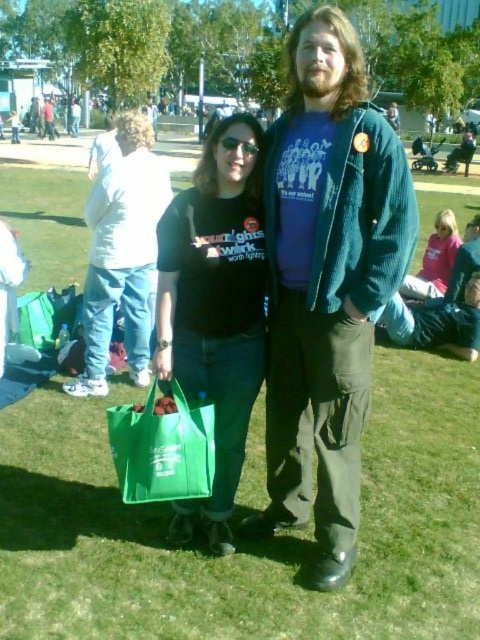
Which of these two, matte black shirt at center or green fabric bag at lower left, stands shorter?

Standing shorter between the two is green fabric bag at lower left.

Can you confirm if matte black shirt at center is bigger than green fabric bag at lower left?

Correct, matte black shirt at center is larger in size than green fabric bag at lower left.

Measure the distance between matte black shirt at center and camera.

matte black shirt at center is 3.74 meters from camera.

I want to click on matte black shirt at center, so click(122, 256).

Can you confirm if matte black shirt at center is shorter than pink fabric shirt at upper right?

No, matte black shirt at center is not shorter than pink fabric shirt at upper right.

What do you see at coordinates (122, 256) in the screenshot? I see `matte black shirt at center` at bounding box center [122, 256].

Is point (166, 205) farther from viewer compared to point (450, 216)?

No, it is not.

Identify the location of matte black shirt at center. The width and height of the screenshot is (480, 640). (122, 256).

Can you confirm if green fabric bag at lower left is wider than matte white shirt at upper left?

Incorrect, green fabric bag at lower left's width does not surpass matte white shirt at upper left's.

Based on the photo, between green fabric bag at lower left and matte white shirt at upper left, which one appears on the right side from the viewer's perspective?

From the viewer's perspective, green fabric bag at lower left appears more on the right side.

What do you see at coordinates (163, 448) in the screenshot? I see `green fabric bag at lower left` at bounding box center [163, 448].

You are a GUI agent. You are given a task and a screenshot of the screen. Output one action in this format:
    pyautogui.click(x=<x>, y=<y>)
    Task: Click on the green fabric bag at lower left
    The image size is (480, 640).
    Given the screenshot: What is the action you would take?
    pyautogui.click(x=163, y=448)